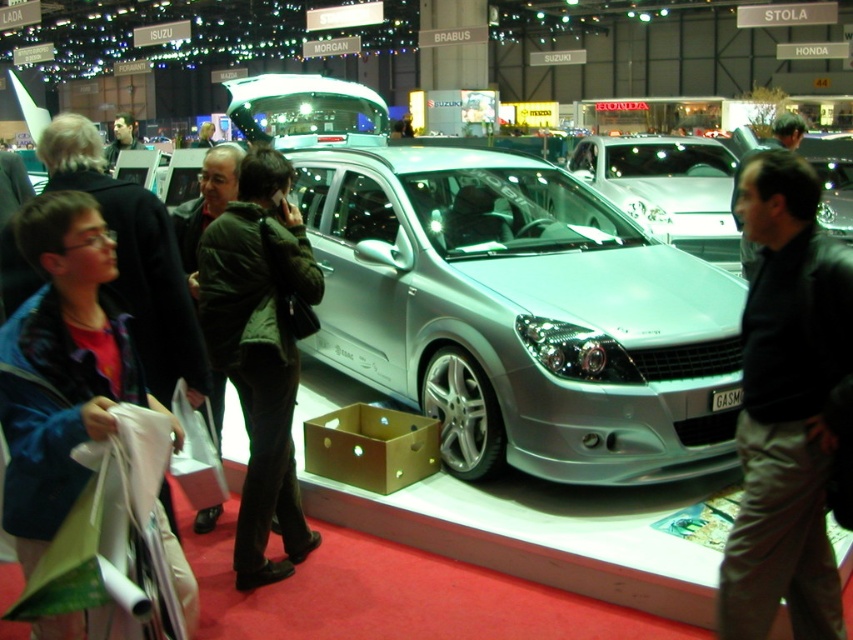
Does black leather jacket at center have a greater height compared to dark green jacket at center?

In fact, black leather jacket at center may be shorter than dark green jacket at center.

Does black leather jacket at center lie in front of dark green jacket at center?

That is True.

This screenshot has height=640, width=853. What are the coordinates of `black leather jacket at center` in the screenshot? It's located at (786, 406).

Who is positioned more to the right, black leather jacket at center or blue denim jacket at lower left?

Positioned to the right is black leather jacket at center.

Can you confirm if black leather jacket at center is thinner than blue denim jacket at lower left?

Correct, black leather jacket at center's width is less than blue denim jacket at lower left's.

Locate an element on the screen. Image resolution: width=853 pixels, height=640 pixels. black leather jacket at center is located at coordinates (786, 406).

Based on the photo, can you confirm if black leather jacket at center is positioned above green corduroy jacket at center?

Incorrect, black leather jacket at center is not positioned above green corduroy jacket at center.

Is black leather jacket at center below green corduroy jacket at center?

Correct, black leather jacket at center is located below green corduroy jacket at center.

Between point (824, 492) and point (260, 518), which one is positioned behind?

Point (260, 518)

The image size is (853, 640). I want to click on black leather jacket at center, so click(x=786, y=406).